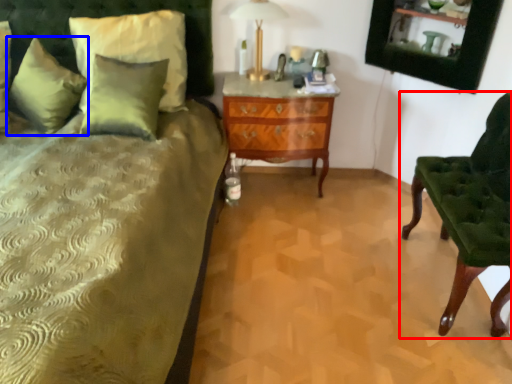
Question: Which object is closer to the camera taking this photo, chair (highlighted by a red box) or pillow (highlighted by a blue box)?

Choices:
 (A) chair
 (B) pillow

Answer: (A)